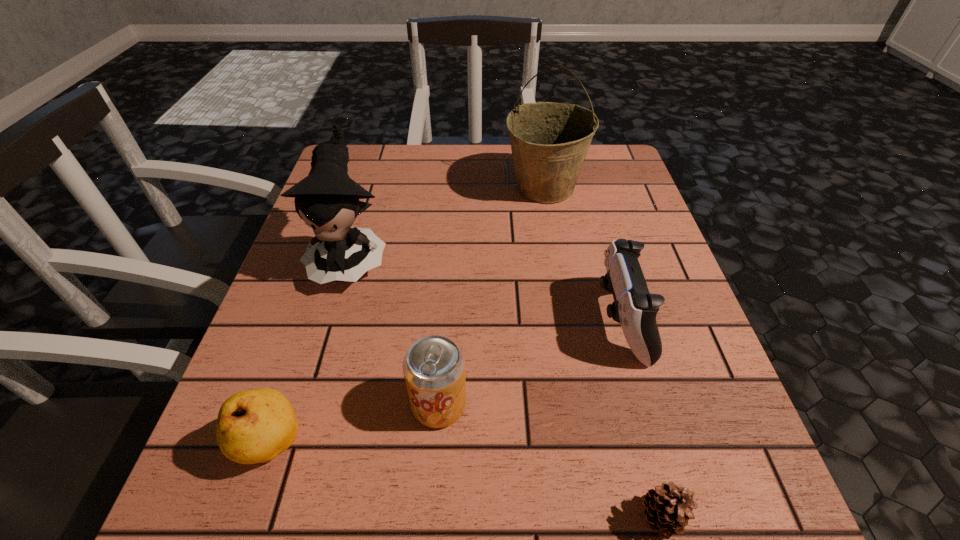
Where is `object present at the far right corner`? Image resolution: width=960 pixels, height=540 pixels. object present at the far right corner is located at coordinates (549, 141).

At what (x,y) coordinates should I click in order to perform the action: click on vacant space at the far edge of the desktop. Please return your answer as a coordinate pair (x, y). The width and height of the screenshot is (960, 540). Looking at the image, I should click on (477, 164).

I want to click on vacant area at the near edge, so click(x=494, y=484).

Find the location of a particular element. This screenshot has width=960, height=540. blank space at the left edge of the desktop is located at coordinates (255, 376).

In the image, there is a desktop. In order to click on vacant space at the far left corner in this screenshot , I will do `click(388, 150)`.

In order to click on vacant space at the near left corner in this screenshot , I will do `click(300, 476)`.

Locate an element on the screen. Image resolution: width=960 pixels, height=540 pixels. free space at the far right corner of the desktop is located at coordinates (584, 192).

You are a GUI agent. You are given a task and a screenshot of the screen. Output one action in this format:
    pyautogui.click(x=<x>, y=<y>)
    Task: Click on the free space between the doll and the pear
    
    Given the screenshot: What is the action you would take?
    pyautogui.click(x=311, y=350)

What are the coordinates of `blank region between the wine bucket and the control` in the screenshot? It's located at (583, 254).

At what (x,y) coordinates should I click in order to perform the action: click on blank region between the fourth object from right to left and the control. Please return your answer as a coordinate pair (x, y). The image size is (960, 540). Looking at the image, I should click on (530, 363).